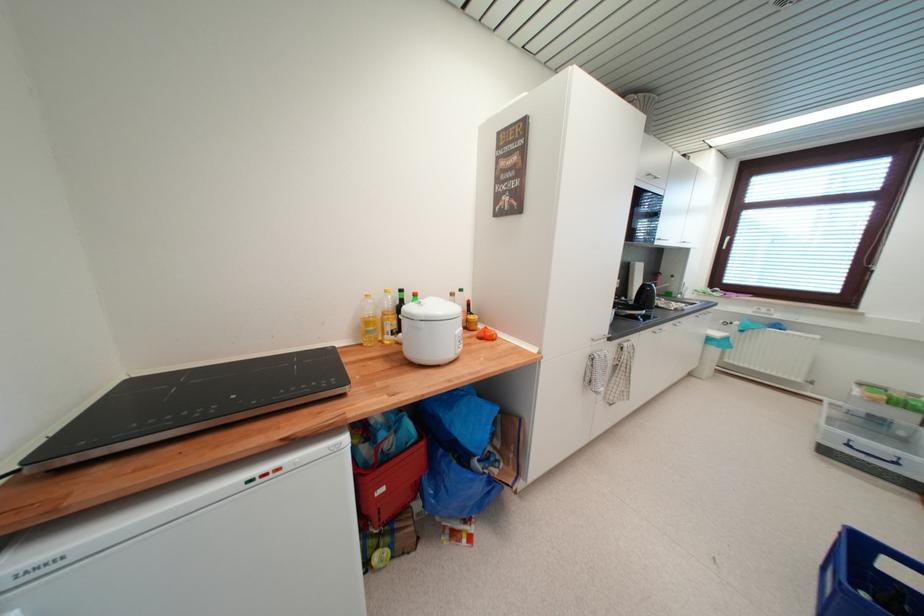
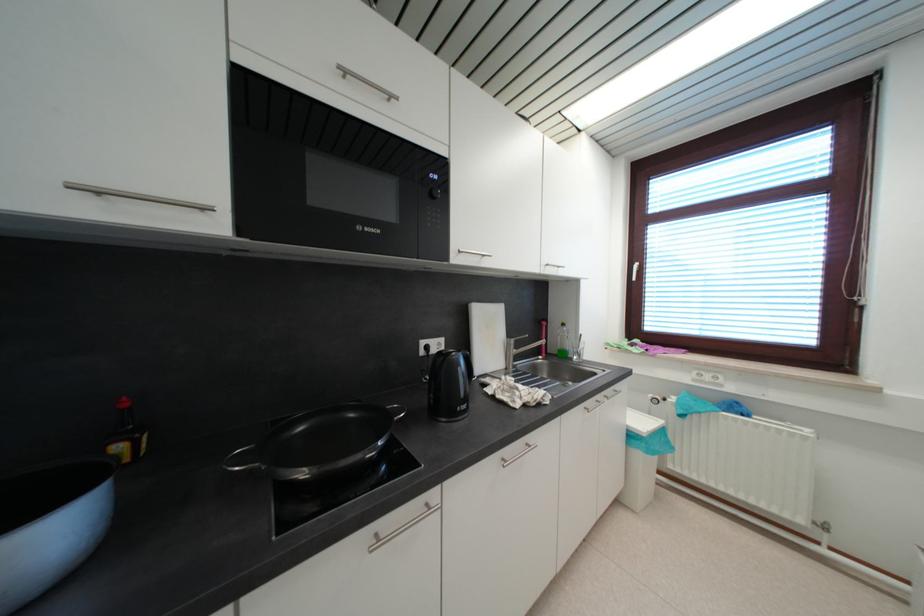
The images are taken continuously from a first-person perspective. In which direction are you moving?

The movement direction of the cameraman is right, forward.